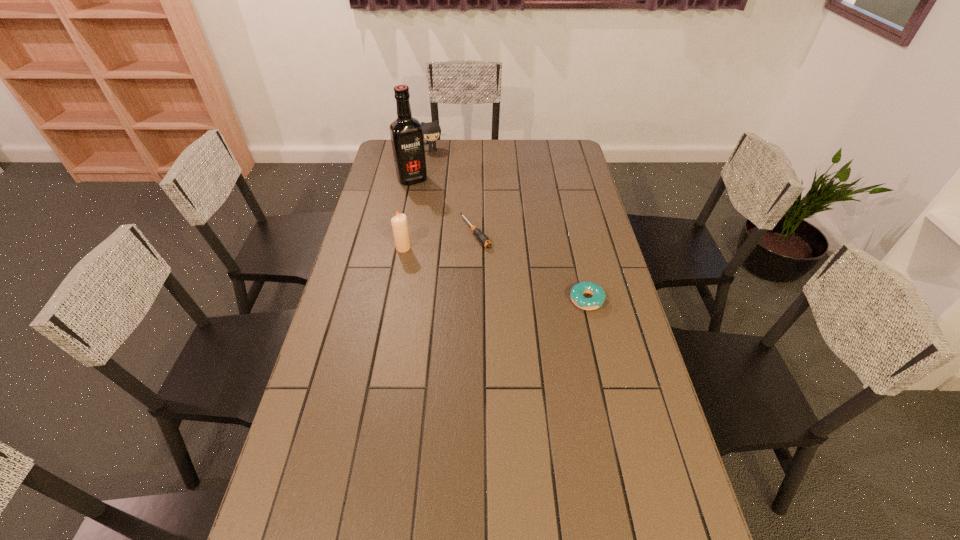
Identify the location of free spot on the desktop that is between the second tallest object and the doughnut and is positioned on the front-facing side of the kitten. (482, 271).

This screenshot has height=540, width=960. Find the location of `vacant space on the desktop that is between the second tallest object and the doughnut and is positioned at the tip of the second object from right to left`. vacant space on the desktop that is between the second tallest object and the doughnut and is positioned at the tip of the second object from right to left is located at coordinates (516, 280).

The width and height of the screenshot is (960, 540). In order to click on free space on the desktop that is between the candle and the nearest object and is positioned on the front-facing side of the liquor in this screenshot , I will do `click(470, 267)`.